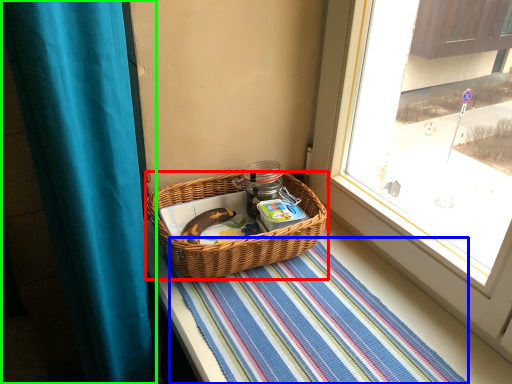
Question: Which object is the farthest from picnic basket (highlighted by a red box)? Choose among these: mat (highlighted by a blue box) or curtain (highlighted by a green box).

Choices:
 (A) mat
 (B) curtain

Answer: (B)